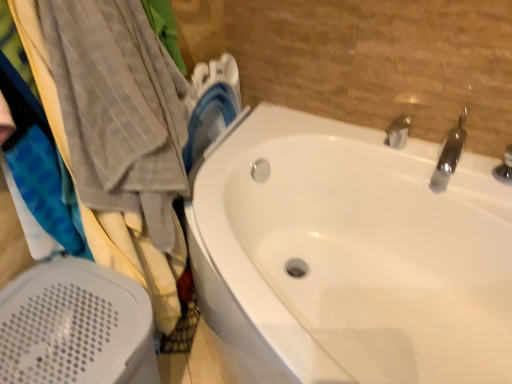
Question: From the image's perspective, is white glossy bathtub at center located above or below white plastic bath heater at lower left?

Choices:
 (A) below
 (B) above

Answer: (B)

Question: Is white glossy bathtub at center bigger or smaller than white plastic bath heater at lower left?

Choices:
 (A) small
 (B) big

Answer: (B)

Question: Which of these objects is positioned farthest from the silver metallic tap at upper right, the 2th tap in the right-to-left sequence?

Choices:
 (A) polished chrome faucet at upper right, acting as the 2th tap starting from the left
 (B) white plastic bath heater at lower left
 (C) white glossy bathtub at center

Answer: (B)

Question: Estimate the real-world distances between objects in this image. Which object is farther from the white glossy bathtub at center?

Choices:
 (A) silver metallic tap at upper right, the 2th tap in the right-to-left sequence
 (B) polished chrome faucet at upper right, the first tap when ordered from right to left
 (C) white plastic bath heater at lower left

Answer: (C)